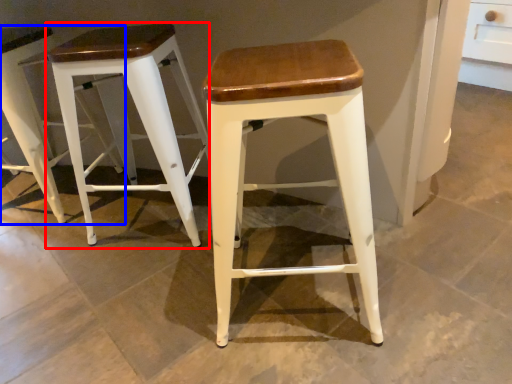
Question: Among these objects, which one is farthest to the camera, stool (highlighted by a red box) or stool (highlighted by a blue box)?

Choices:
 (A) stool
 (B) stool

Answer: (B)